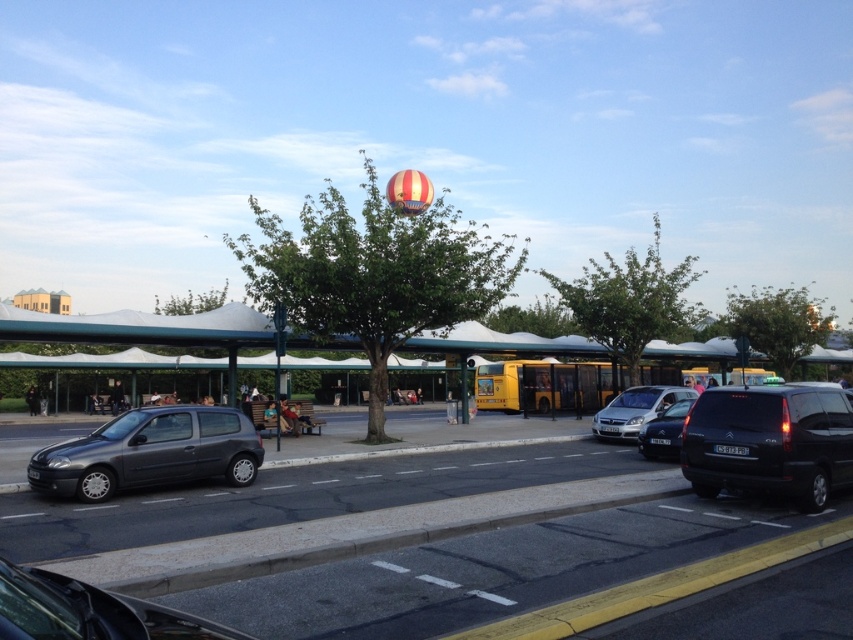
Question: Considering the relative positions of satin silver van at center and satin black car at center in the image provided, where is satin silver van at center located with respect to satin black car at center?

Choices:
 (A) right
 (B) left

Answer: (A)

Question: From the image, what is the correct spatial relationship of satin silver van at center in relation to satin black car at center?

Choices:
 (A) right
 (B) left

Answer: (A)

Question: Which is nearer to the metallic gray car at lower left?

Choices:
 (A) matte black hatchback at left
 (B) satin silver van at center

Answer: (A)

Question: Does metallic gray car at lower left appear under satin silver van at center?

Choices:
 (A) no
 (B) yes

Answer: (A)

Question: Which point appears farthest from the camera in this image?

Choices:
 (A) (666, 429)
 (B) (100, 605)
 (C) (772, 481)
 (D) (231, 435)

Answer: (A)

Question: Considering the real-world distances, which object is closest to the metallic gray car at lower left?

Choices:
 (A) satin silver van at center
 (B) satin black car at center
 (C) black matte van at right

Answer: (C)